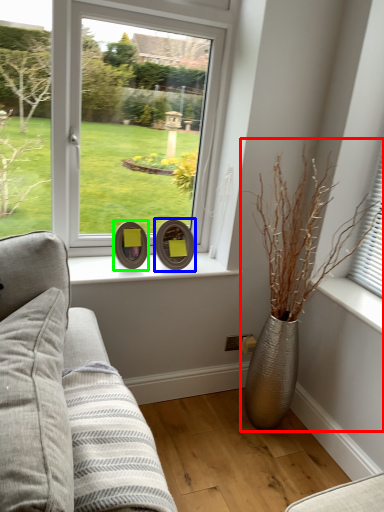
Question: Which object is positioned farthest from houseplant (highlighted by a red box)? Select from picture frame (highlighted by a blue box) and picture frame (highlighted by a green box).

Choices:
 (A) picture frame
 (B) picture frame

Answer: (B)